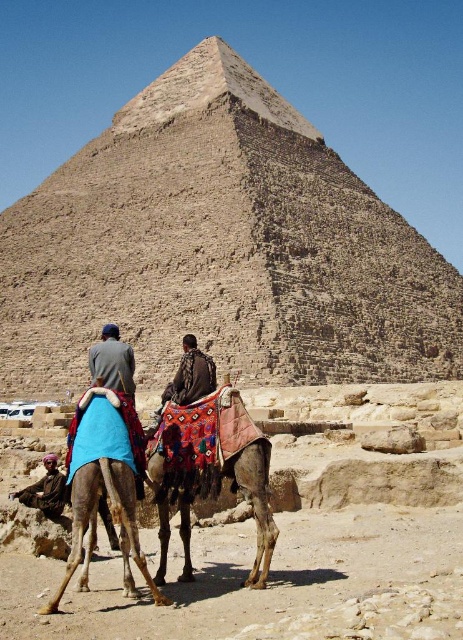
Is brown stone pyramid at center bigger than blue fabric cloth at center?

Yes, brown stone pyramid at center is bigger than blue fabric cloth at center.

Can you confirm if brown stone pyramid at center is wider than blue fabric cloth at center?

Indeed, brown stone pyramid at center has a greater width compared to blue fabric cloth at center.

Which is behind, point (350, 180) or point (118, 384)?

Positioned behind is point (350, 180).

At what (x,y) coordinates should I click in order to perform the action: click on brown stone pyramid at center. Please return your answer as a coordinate pair (x, y). Looking at the image, I should click on (219, 248).

Between brown textured camel at lower left and blue fabric camel at lower left, which one is positioned higher?

blue fabric camel at lower left is higher up.

I want to click on brown textured camel at lower left, so click(x=298, y=540).

Does multicolored fabric camel at center come in front of blue fabric camel at lower left?

No, it is not.

Can you confirm if multicolored fabric camel at center is positioned to the left of blue fabric camel at lower left?

No, multicolored fabric camel at center is not to the left of blue fabric camel at lower left.

Is point (168, 476) behind point (118, 477)?

Yes, point (168, 476) is behind point (118, 477).

Locate an element on the screen. The width and height of the screenshot is (463, 640). multicolored fabric camel at center is located at coordinates (212, 474).